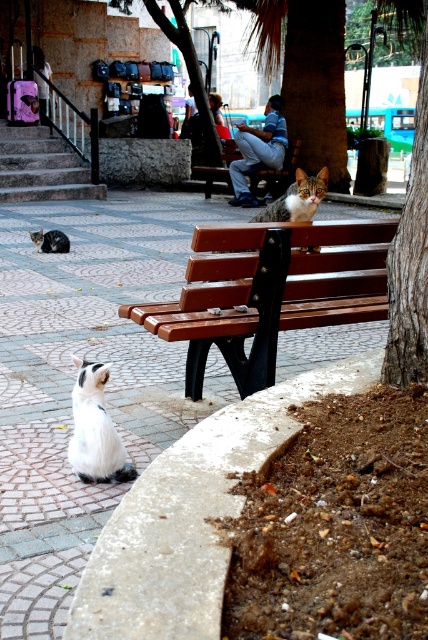
Who is shorter, green textured tree at center or white fluffy cat at lower left?

With less height is white fluffy cat at lower left.

What do you see at coordinates (410, 228) in the screenshot?
I see `green textured tree at center` at bounding box center [410, 228].

You are a GUI agent. You are given a task and a screenshot of the screen. Output one action in this format:
    pyautogui.click(x=<x>, y=<y>)
    Task: Click on the green textured tree at center
    
    Given the screenshot: What is the action you would take?
    pyautogui.click(x=410, y=228)

Is point (389, 349) behind point (226, 163)?

No, it is not.

Is green textured tree at center to the right of brown wooden bench at center from the viewer's perspective?

Yes, green textured tree at center is to the right of brown wooden bench at center.

Locate an element on the screen. The width and height of the screenshot is (428, 640). green textured tree at center is located at coordinates (410, 228).

This screenshot has width=428, height=640. Identify the location of green textured tree at center. (410, 228).

Between point (231, 342) and point (293, 163), which one is positioned behind?

The point (293, 163) is more distant.

Find the location of a particular element. This screenshot has width=428, height=640. wooden bench at center is located at coordinates (269, 291).